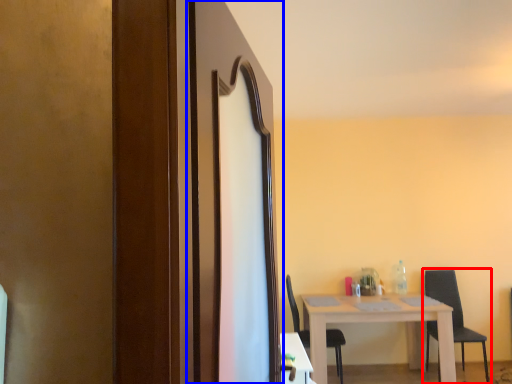
Question: Which of the following is the farthest to the observer, chair (highlighted by a red box) or screen door (highlighted by a blue box)?

Choices:
 (A) chair
 (B) screen door

Answer: (A)